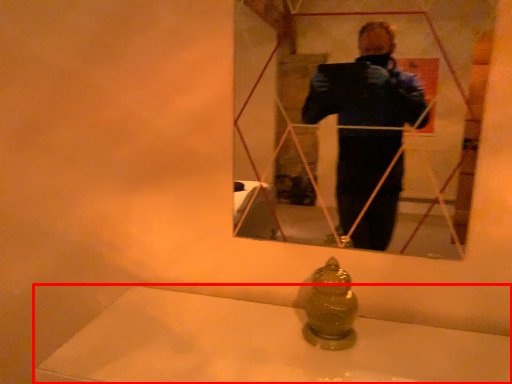
Question: Considering the relative positions of bath (annotated by the red box) and mirror in the image provided, where is bath (annotated by the red box) located with respect to the staircase?

Choices:
 (A) right
 (B) left

Answer: (B)